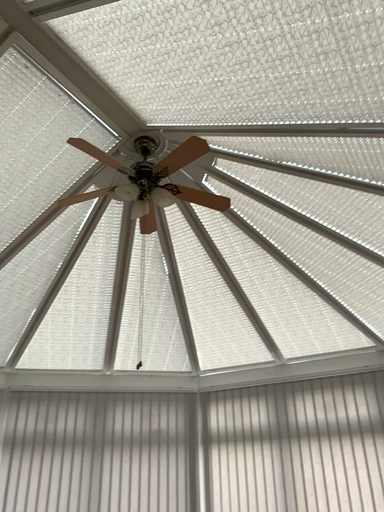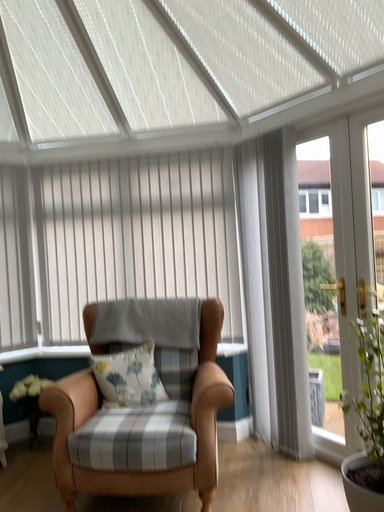
Question: Which way did the camera rotate in the video?

Choices:
 (A) rotated left
 (B) rotated right

Answer: (B)